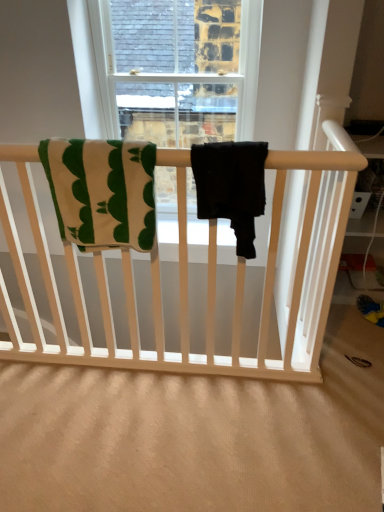
Question: Is there a large distance between green striped towel at upper left, which appears as the 1th beach towel when viewed from the left, and black matte pants at center, which is the second beach towel from left to right?

Choices:
 (A) no
 (B) yes

Answer: (A)

Question: From the image's perspective, does green striped towel at upper left, which appears as the 1th beach towel when viewed from the left, appear higher than black matte pants at center, which is the second beach towel from left to right?

Choices:
 (A) yes
 (B) no

Answer: (A)

Question: Considering the relative sizes of green striped towel at upper left, which appears as the 1th beach towel when viewed from the left, and black matte pants at center, which is the second beach towel from left to right, in the image provided, is green striped towel at upper left, which appears as the 1th beach towel when viewed from the left, wider than black matte pants at center, which is the second beach towel from left to right,?

Choices:
 (A) yes
 (B) no

Answer: (B)

Question: Considering the relative sizes of green striped towel at upper left, which appears as the 1th beach towel when viewed from the left, and black matte pants at center, the first beach towel from the right, in the image provided, is green striped towel at upper left, which appears as the 1th beach towel when viewed from the left, smaller than black matte pants at center, the first beach towel from the right,?

Choices:
 (A) no
 (B) yes

Answer: (A)

Question: Is green striped towel at upper left, the second beach towel positioned from the right, positioned before black matte pants at center, which is the second beach towel from left to right?

Choices:
 (A) yes
 (B) no

Answer: (B)

Question: Is black matte pants at center, which is the second beach towel from left to right, a part of green striped towel at upper left, which appears as the 1th beach towel when viewed from the left?

Choices:
 (A) no
 (B) yes

Answer: (A)

Question: Considering the relative positions of black matte pants at center, the first beach towel from the right, and green striped towel at upper left, the second beach towel positioned from the right, in the image provided, is black matte pants at center, the first beach towel from the right, to the left of green striped towel at upper left, the second beach towel positioned from the right, from the viewer's perspective?

Choices:
 (A) yes
 (B) no

Answer: (B)

Question: Can we say black matte pants at center, the first beach towel from the right, lies outside green striped towel at upper left, the second beach towel positioned from the right?

Choices:
 (A) yes
 (B) no

Answer: (A)

Question: Considering the relative sizes of black matte pants at center, which is the second beach towel from left to right, and green striped towel at upper left, which appears as the 1th beach towel when viewed from the left, in the image provided, is black matte pants at center, which is the second beach towel from left to right, smaller than green striped towel at upper left, which appears as the 1th beach towel when viewed from the left,?

Choices:
 (A) yes
 (B) no

Answer: (A)

Question: Would you say black matte pants at center, which is the second beach towel from left to right, contains green striped towel at upper left, the second beach towel positioned from the right?

Choices:
 (A) yes
 (B) no

Answer: (B)

Question: Is black matte pants at center, which is the second beach towel from left to right, positioned behind green striped towel at upper left, the second beach towel positioned from the right?

Choices:
 (A) no
 (B) yes

Answer: (A)

Question: Are black matte pants at center, the first beach towel from the right, and green striped towel at upper left, the second beach towel positioned from the right, far apart?

Choices:
 (A) yes
 (B) no

Answer: (B)

Question: From the image's perspective, is green striped towel at upper left, which appears as the 1th beach towel when viewed from the left, above or below black matte pants at center, which is the second beach towel from left to right?

Choices:
 (A) below
 (B) above

Answer: (B)